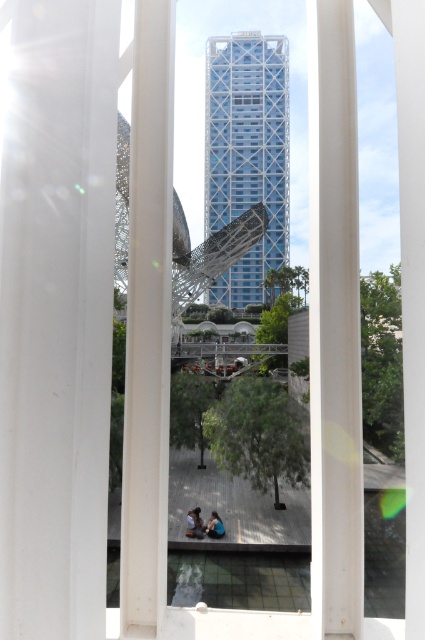
You are a window cleaner standing at the base of the white smooth pillar at left and the blue denim jeans at lower center. Which object will require you to climb higher to clean?

The white smooth pillar at left will require climbing higher because it is much taller than the blue denim jeans at lower center.